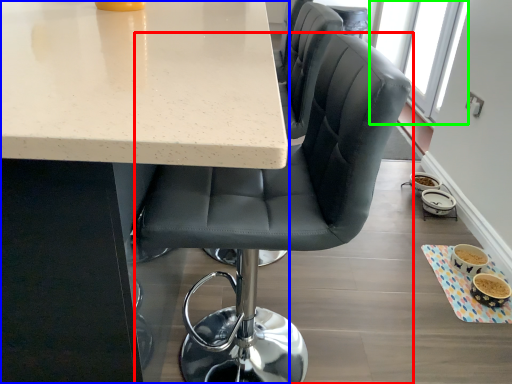
Question: Which is farther away from chair (highlighted by a red box)? table (highlighted by a blue box) or window screen (highlighted by a green box)?

Choices:
 (A) table
 (B) window screen

Answer: (B)